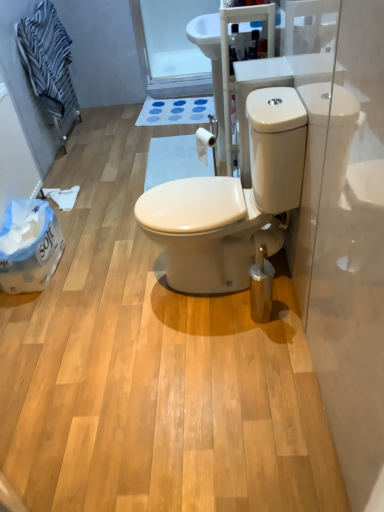
Image resolution: width=384 pixels, height=512 pixels. I want to click on vacant area that lies in front of white glossy toilet at center, so click(x=217, y=355).